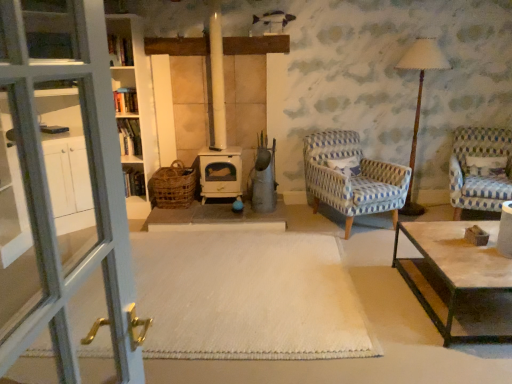
Question: Do you think wooden bookshelf at center is within blue and white woven armchair at center-right, positioned as the second chair in right-to-left order, or outside of it?

Choices:
 (A) outside
 (B) inside

Answer: (A)

Question: Looking at their shapes, would you say wooden bookshelf at center is wider or thinner than blue and white woven armchair at center-right, positioned as the second chair in right-to-left order?

Choices:
 (A) thin
 (B) wide

Answer: (A)

Question: Which object is positioned farthest from the rustic wicker basket at center?

Choices:
 (A) wooden bookshelf at center
 (B) white carpet at center
 (C) white textured pillow at right
 (D) blue and white checkered fabric armchair at right, the 1th chair from the right
 (E) blue and white woven armchair at center-right, which ranks as the 1th chair in left-to-right order

Answer: (C)

Question: Which object is the closest to the rustic wicker basket at center?

Choices:
 (A) white carpet at center
 (B) wooden bookshelf at center
 (C) wooden table lamp at right
 (D) blue and white checkered fabric armchair at right, the 1th chair from the right
 (E) blue and white woven armchair at center-right, positioned as the second chair in right-to-left order

Answer: (B)